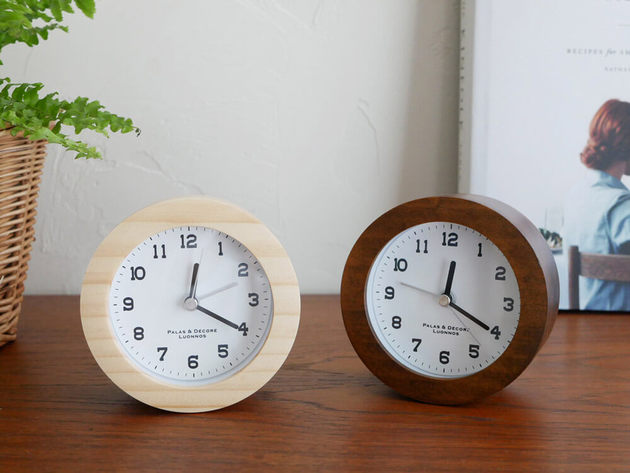
I want to click on plant, so click(x=14, y=23).